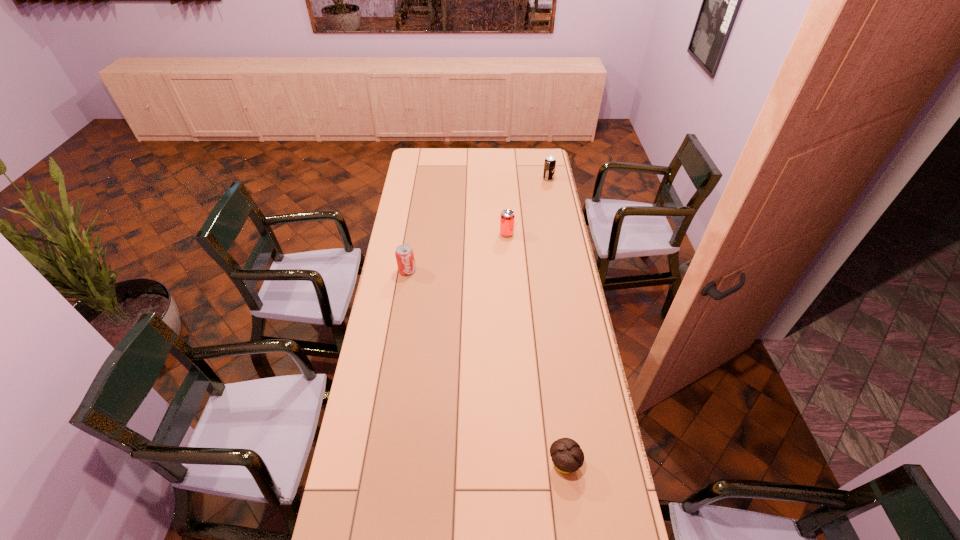
I want to click on the nearest soda can, so click(x=404, y=253).

Find the location of a particular element. The width and height of the screenshot is (960, 540). the leftmost object is located at coordinates (404, 253).

Where is `the second nearest soda can`? the second nearest soda can is located at coordinates (507, 217).

Identify the location of the second soda can from right to left. (507, 217).

What are the coordinates of `the farthest soda can` in the screenshot? It's located at (550, 163).

Locate an element on the screen. This screenshot has width=960, height=540. the farthest object is located at coordinates (550, 163).

This screenshot has width=960, height=540. What are the coordinates of `the shortest object` in the screenshot? It's located at (567, 456).

Locate an element on the screen. The image size is (960, 540). the third object from left to right is located at coordinates (567, 456).

This screenshot has width=960, height=540. Find the location of `vacant space situated 0.280m on the right of the second nearest object`. vacant space situated 0.280m on the right of the second nearest object is located at coordinates (479, 271).

At what (x,y) coordinates should I click in order to perform the action: click on vacant space located on the right of the second nearest soda can. Please return your answer as a coordinate pair (x, y). The width and height of the screenshot is (960, 540). Looking at the image, I should click on (524, 234).